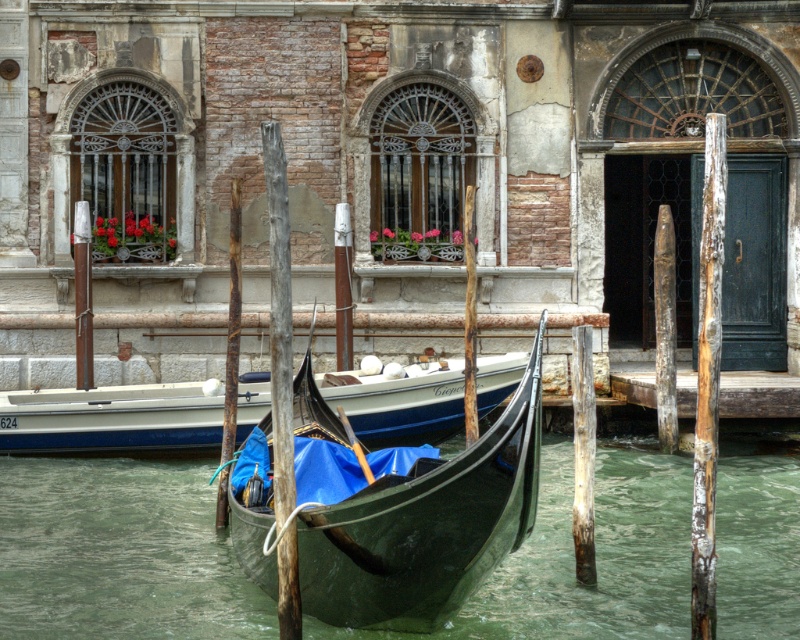
Question: Based on their relative distances, which object is nearer to the shiny dark green gondola at center?

Choices:
 (A) green water at gondola center
 (B) blue fabric gondola at center

Answer: (A)

Question: Is green water at gondola center below blue fabric gondola at center?

Choices:
 (A) yes
 (B) no

Answer: (A)

Question: From the image, what is the correct spatial relationship of green water at gondola center in relation to blue fabric gondola at center?

Choices:
 (A) above
 (B) below

Answer: (B)

Question: Is green water at gondola center to the right of blue fabric gondola at center from the viewer's perspective?

Choices:
 (A) no
 (B) yes

Answer: (B)

Question: Which point is closer to the camera?

Choices:
 (A) (413, 548)
 (B) (206, 502)

Answer: (A)

Question: Which point is farther from the camera taking this photo?

Choices:
 (A) (340, 465)
 (B) (81, 577)
 (C) (168, 417)

Answer: (C)